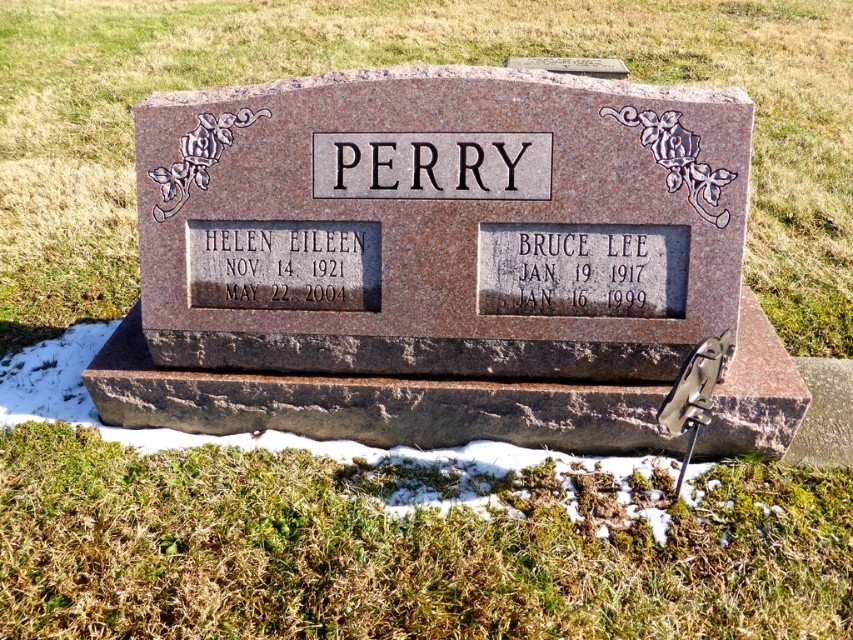
From the picture: Is brown polished stone monument at center taller than green grass at lower center?

Yes, brown polished stone monument at center is taller than green grass at lower center.

Between brown polished stone monument at center and green grass at lower center, which one is positioned lower?

green grass at lower center

Does point (645, 93) come in front of point (418, 588)?

That is False.

The image size is (853, 640). I want to click on brown polished stone monument at center, so click(x=456, y=262).

In the scene shown: Is green grass at lower center positioned before gray stone plaque at right?

Yes, green grass at lower center is in front of gray stone plaque at right.

Between point (15, 584) and point (553, 232), which one is positioned in front?

Positioned in front is point (15, 584).

The height and width of the screenshot is (640, 853). In order to click on green grass at lower center in this screenshot , I will do `click(397, 552)`.

Looking at this image, measure the distance between point (657, 275) and camera.

Point (657, 275) is 3.67 meters away from camera.

Locate an element on the screen. gray stone plaque at right is located at coordinates (582, 269).